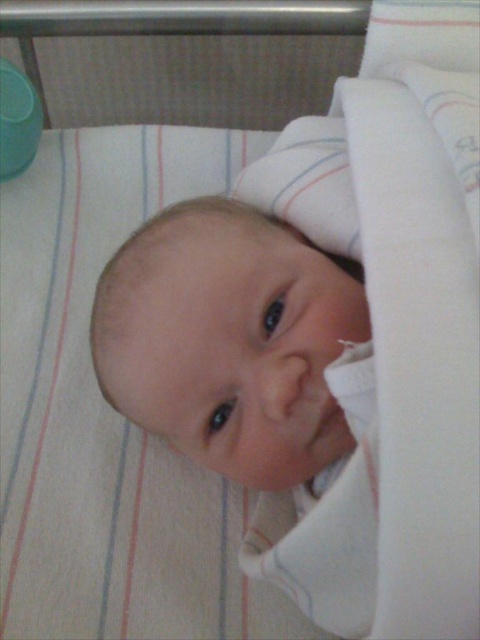
Question: Does smooth skin baby at center have a larger size compared to smooth flesh nose at center?

Choices:
 (A) yes
 (B) no

Answer: (A)

Question: Which point is closer to the camera?

Choices:
 (A) (277, 364)
 (B) (295, 444)

Answer: (A)

Question: Which point appears farthest from the camera in this image?

Choices:
 (A) (298, 372)
 (B) (359, 280)

Answer: (B)

Question: Is smooth skin baby at center to the right of smooth flesh nose at center from the viewer's perspective?

Choices:
 (A) no
 (B) yes

Answer: (A)

Question: Is the position of smooth skin baby at center less distant than that of smooth flesh nose at center?

Choices:
 (A) no
 (B) yes

Answer: (A)